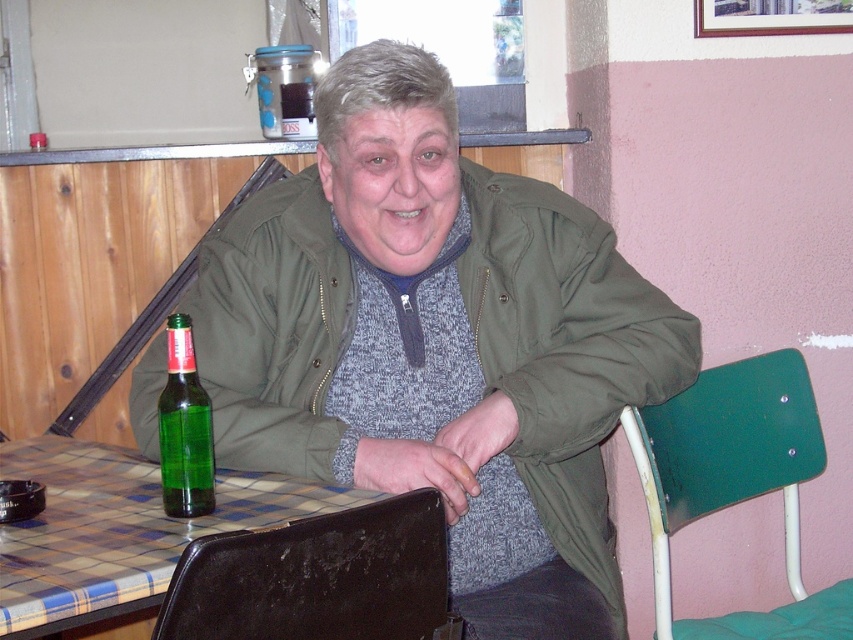
You are a waiter at a cafe and need to place a new order of drinks on the table. The green glass bottle at lower left is currently on the table. Can you place the new drinks on the plaid fabric table at lower left without moving the existing bottle?

The plaid fabric table at lower left is below green glass bottle at lower left, meaning the bottle is on top of the table. Since the table is already occupied by the bottle, you can still place the new drinks on the plaid fabric table at lower left as long as there is enough space around the existing bottle.

You are standing in a cafe and want to sit down. You see a black leather chair at lower center and a green plastic chair at lower right. Which chair is closer to you?

The black leather chair at lower center is closer to you than the green plastic chair at lower right.

Based on the photo, you are a waiter in a restaurant and need to place a new drink order on the table. The table has the plaid fabric table at lower left and the green glass bottle at lower left. Which object should you avoid placing the drink near to ensure it doesn

You should avoid placing the drink near the green glass bottle at lower left because the plaid fabric table at lower left is closer to the viewer, meaning the bottle is farther back on the table. Placing the drink near the bottle might be less stable or harder to reach for the customer.